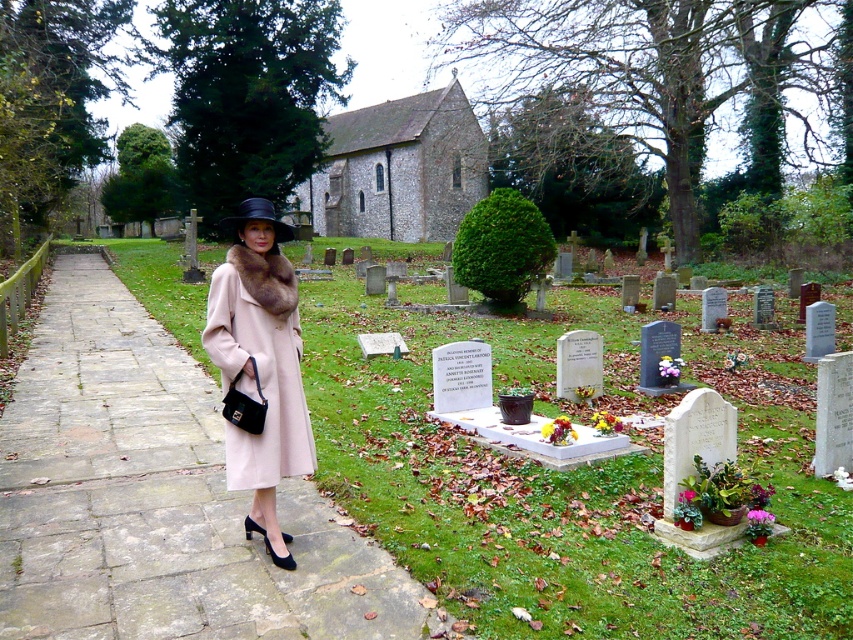
Question: Is matte pink coat at center bigger than black felt hat at center?

Choices:
 (A) no
 (B) yes

Answer: (A)

Question: Which object is closer to the camera taking this photo?

Choices:
 (A) matte pink coat at center
 (B) black felt hat at center

Answer: (A)

Question: Does matte pink coat at center have a lesser width compared to black felt hat at center?

Choices:
 (A) yes
 (B) no

Answer: (A)

Question: Does matte pink coat at center appear on the right side of black felt hat at center?

Choices:
 (A) yes
 (B) no

Answer: (A)

Question: Which point is farther to the camera?

Choices:
 (A) (280, 237)
 (B) (254, 250)

Answer: (A)